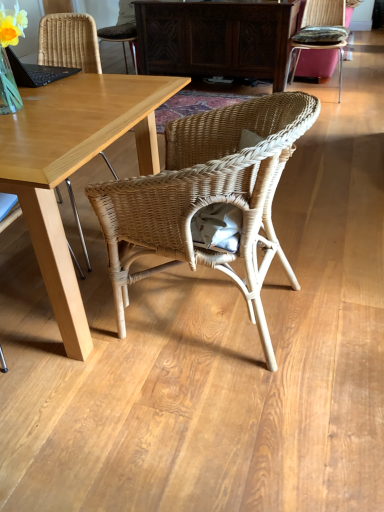
What are the coordinates of `vacant space in front of natural wicker chair at center, which is counted as the 3th chair, starting from the top` in the screenshot? It's located at (217, 426).